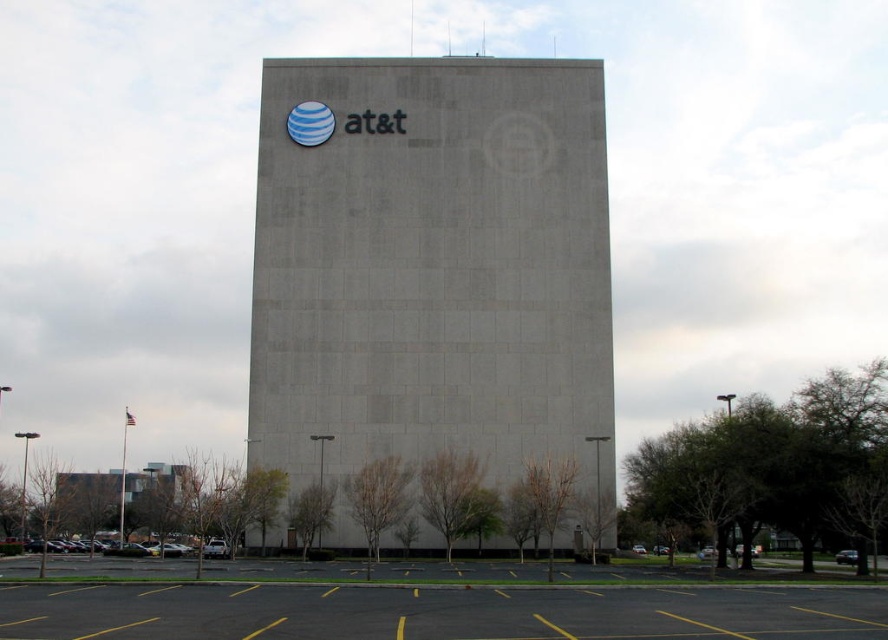
Looking at this image, who is higher up, gray concrete building at center or yellow asphalt parking lot at lower center?

gray concrete building at center is higher up.

Between gray concrete building at center and yellow asphalt parking lot at lower center, which one appears on the left side from the viewer's perspective?

From the viewer's perspective, gray concrete building at center appears more on the left side.

Find the location of `gray concrete building at center`. gray concrete building at center is located at coordinates (433, 268).

Does yellow asphalt parking lot at lower center appear on the right side of gray asphalt parking lot at lower left?

Correct, you'll find yellow asphalt parking lot at lower center to the right of gray asphalt parking lot at lower left.

You are a GUI agent. You are given a task and a screenshot of the screen. Output one action in this format:
    pyautogui.click(x=<x>, y=<y>)
    Task: Click on the yellow asphalt parking lot at lower center
    The image size is (888, 640).
    Given the screenshot: What is the action you would take?
    pyautogui.click(x=427, y=600)

Where is `yellow asphalt parking lot at lower center`? This screenshot has width=888, height=640. yellow asphalt parking lot at lower center is located at coordinates (427, 600).

Looking at this image, is gray concrete building at center closer to the viewer compared to gray asphalt parking lot at lower left?

No, it is behind gray asphalt parking lot at lower left.

Who is more forward, (603,326) or (102,552)?

Point (102,552) is in front.

Is point (306, 80) positioned after point (156, 544)?

That is False.

Locate an element on the screen. This screenshot has width=888, height=640. gray concrete building at center is located at coordinates (433, 268).